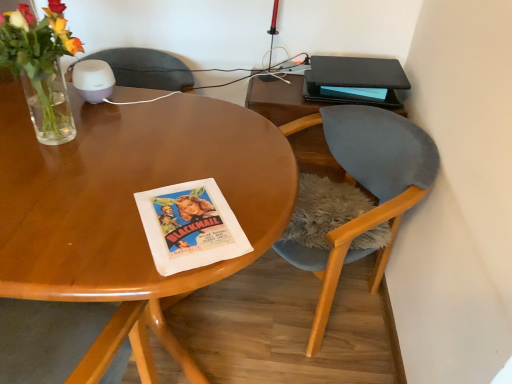
Question: Is velvet grey chair at right at the back of black matte book at upper right?

Choices:
 (A) no
 (B) yes

Answer: (A)

Question: From a real-world perspective, is black matte book at upper right positioned under velvet grey chair at right based on gravity?

Choices:
 (A) yes
 (B) no

Answer: (B)

Question: Does black matte book at upper right have a smaller size compared to velvet grey chair at right?

Choices:
 (A) yes
 (B) no

Answer: (A)

Question: Can you confirm if black matte book at upper right is positioned to the right of velvet grey chair at right?

Choices:
 (A) no
 (B) yes

Answer: (B)

Question: Can you confirm if black matte book at upper right is wider than velvet grey chair at right?

Choices:
 (A) yes
 (B) no

Answer: (B)

Question: From a real-world perspective, is black matte book at upper right located higher than velvet grey chair at right?

Choices:
 (A) no
 (B) yes

Answer: (B)

Question: Is black matte book at upper right located within velvet grey chair at right?

Choices:
 (A) yes
 (B) no

Answer: (B)

Question: Is velvet grey chair at right oriented towards black matte book at upper right?

Choices:
 (A) no
 (B) yes

Answer: (A)

Question: Does velvet grey chair at right come in front of black matte book at upper right?

Choices:
 (A) no
 (B) yes

Answer: (B)

Question: Is velvet grey chair at right beside black matte book at upper right?

Choices:
 (A) no
 (B) yes

Answer: (A)

Question: Does velvet grey chair at right have a lesser height compared to black matte book at upper right?

Choices:
 (A) no
 (B) yes

Answer: (A)

Question: Can you confirm if velvet grey chair at right is smaller than black matte book at upper right?

Choices:
 (A) yes
 (B) no

Answer: (B)

Question: Does point click(x=365, y=99) appear closer or farther from the camera than point click(x=294, y=122)?

Choices:
 (A) closer
 (B) farther

Answer: (B)